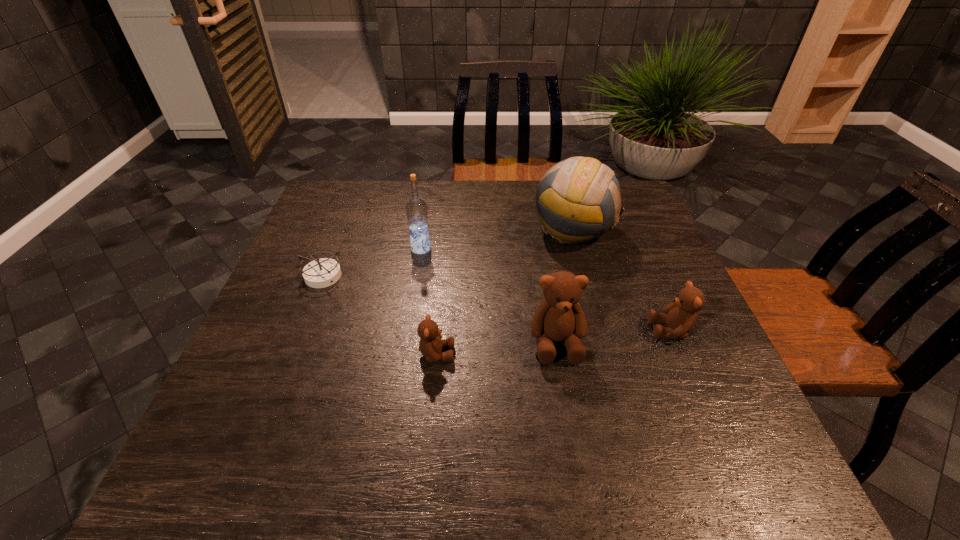
This screenshot has width=960, height=540. Identify the location of the second shortest object. (430, 345).

Where is `the shortest teddy bear`? This screenshot has width=960, height=540. the shortest teddy bear is located at coordinates click(x=430, y=345).

Locate an element on the screen. the tallest teddy bear is located at coordinates (559, 317).

The width and height of the screenshot is (960, 540). What are the coordinates of `the second teddy bear from right to left` in the screenshot? It's located at (559, 317).

At what (x,y) coordinates should I click in order to perform the action: click on the rightmost teddy bear. Please return your answer as a coordinate pair (x, y). Looking at the image, I should click on (680, 317).

The width and height of the screenshot is (960, 540). I want to click on the second shortest teddy bear, so click(x=680, y=317).

Identify the location of volleyball. The height and width of the screenshot is (540, 960). (578, 199).

This screenshot has width=960, height=540. What are the coordinates of `vodka` in the screenshot? It's located at (416, 208).

This screenshot has height=540, width=960. I want to click on compass, so click(324, 272).

This screenshot has width=960, height=540. I want to click on the shortest object, so click(324, 272).